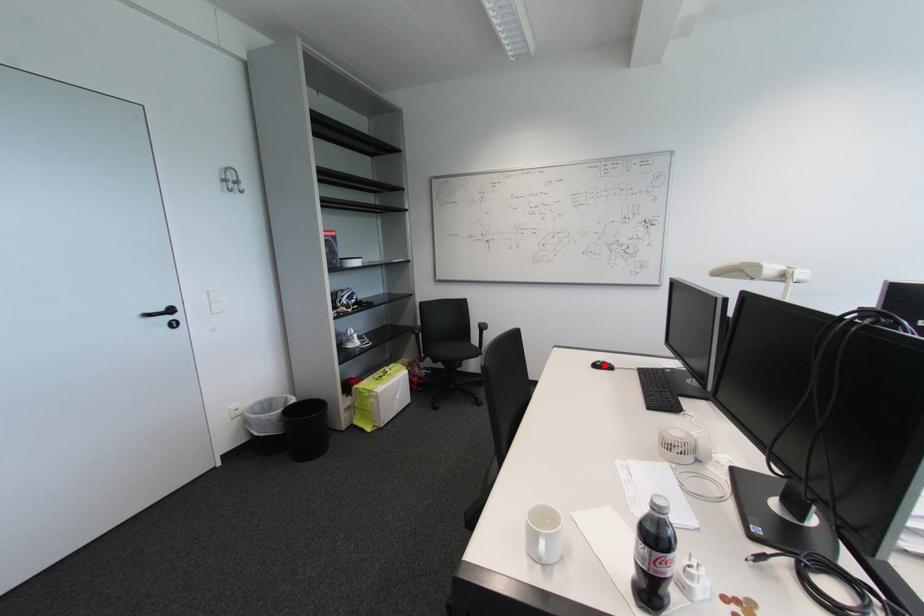
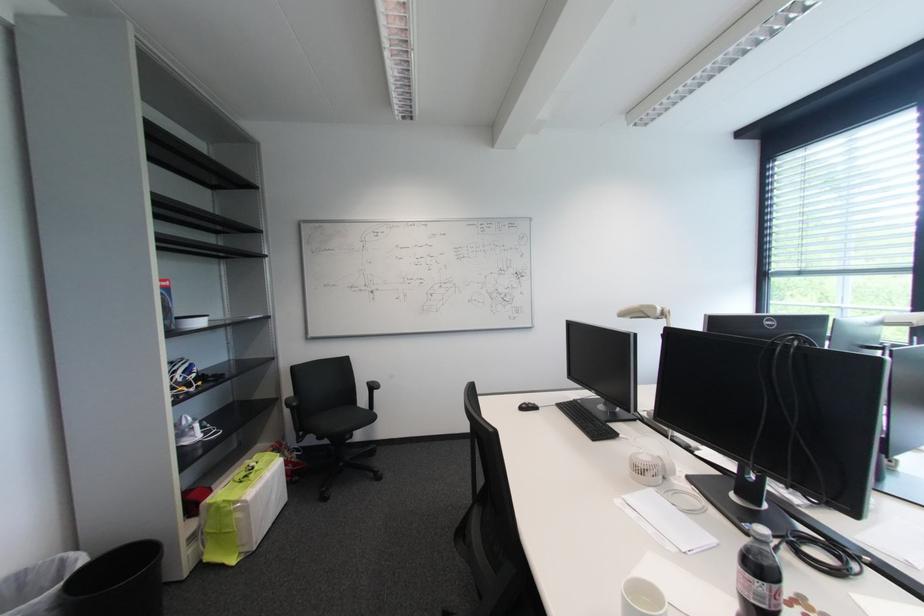
Locate, in the second image, the point that corresponds to the highlighted location in the first image.

(530, 408)